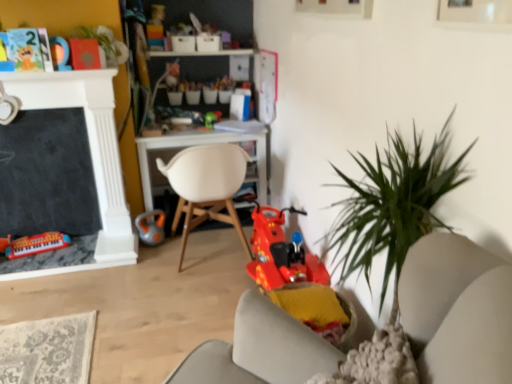
Question: Is matte plastic keyboard at lower left, arranged as the first toy when viewed from the left, a part of orange rubber kettlebell at center, acting as the 3th toy starting from the right?

Choices:
 (A) yes
 (B) no

Answer: (B)

Question: Can you confirm if orange rubber kettlebell at center, acting as the 3th toy starting from the right, is bigger than matte plastic keyboard at lower left, the fifth toy positioned from the top?

Choices:
 (A) no
 (B) yes

Answer: (A)

Question: Does orange rubber kettlebell at center, acting as the 3th toy starting from the right, have a greater width compared to matte plastic keyboard at lower left, the fifth toy viewed from the right?

Choices:
 (A) yes
 (B) no

Answer: (B)

Question: Is orange rubber kettlebell at center, acting as the 3th toy starting from the right, smaller than matte plastic keyboard at lower left, the first toy positioned from the bottom?

Choices:
 (A) no
 (B) yes

Answer: (B)

Question: From the image's perspective, does orange rubber kettlebell at center, acting as the 3th toy starting from the right, appear lower than matte plastic keyboard at lower left, the fifth toy viewed from the right?

Choices:
 (A) yes
 (B) no

Answer: (B)

Question: Based on their positions, is shiny plastic scooter at center, the 1th toy when ordered from right to left, located to the left or right of orange rubber kettlebell at center, the third toy positioned from the bottom?

Choices:
 (A) left
 (B) right

Answer: (B)

Question: Is shiny plastic scooter at center, the second toy when ordered from bottom to top, taller or shorter than orange rubber kettlebell at center, acting as the 3th toy starting from the right?

Choices:
 (A) short
 (B) tall

Answer: (B)

Question: Looking at their shapes, would you say shiny plastic scooter at center, acting as the 5th toy starting from the left, is wider or thinner than orange rubber kettlebell at center, the 3th toy viewed from the top?

Choices:
 (A) thin
 (B) wide

Answer: (B)

Question: From a real-world perspective, is shiny plastic scooter at center, which is the 4th toy from top to bottom, positioned above or below orange rubber kettlebell at center, the 3th toy viewed from the top?

Choices:
 (A) below
 (B) above

Answer: (B)

Question: From a real-world perspective, is white matte chair at center above or below orange rubber kettlebell at center, placed as the third toy when sorted from left to right?

Choices:
 (A) below
 (B) above

Answer: (B)

Question: Do you think white matte chair at center is within orange rubber kettlebell at center, the 3th toy viewed from the top, or outside of it?

Choices:
 (A) outside
 (B) inside

Answer: (A)

Question: Considering the positions of white matte chair at center and orange rubber kettlebell at center, the third toy positioned from the bottom, in the image, is white matte chair at center bigger or smaller than orange rubber kettlebell at center, the third toy positioned from the bottom,?

Choices:
 (A) small
 (B) big

Answer: (B)

Question: Visually, is white matte chair at center positioned to the left or to the right of orange rubber kettlebell at center, the 3th toy viewed from the top?

Choices:
 (A) left
 (B) right

Answer: (B)

Question: Relative to green leafy plant at upper left, is green plastic toy at center, the 4th toy when ordered from bottom to top, in front or behind?

Choices:
 (A) behind
 (B) front

Answer: (A)

Question: In terms of height, does green plastic toy at center, placed as the 4th toy when sorted from left to right, look taller or shorter compared to green leafy plant at upper left?

Choices:
 (A) short
 (B) tall

Answer: (A)